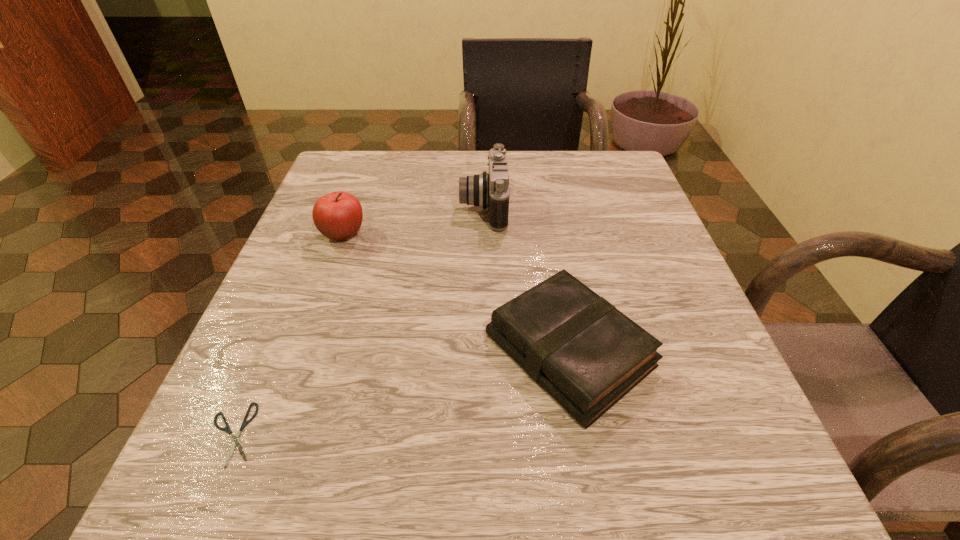
The image size is (960, 540). What are the coordinates of `vacant region that satisfies the following two spatial constraints: 1. on the back side of the shears; 2. on the left side of the book` in the screenshot? It's located at (268, 350).